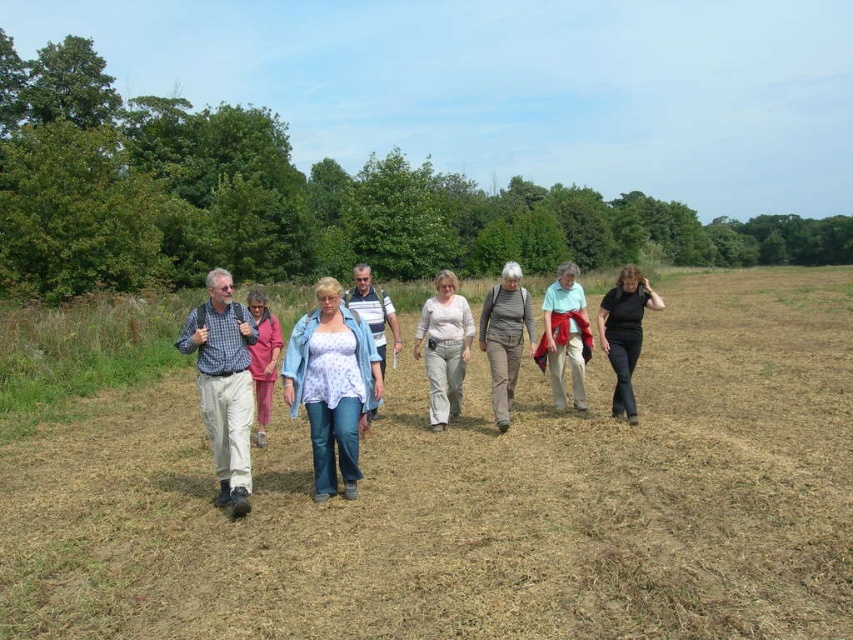
Question: In this image, where is blue denim jeans at center located relative to light beige pants at center?

Choices:
 (A) right
 (B) left

Answer: (B)

Question: Which is farther from the black matte pants at lower right?

Choices:
 (A) light blue denim jeans at center
 (B) gray cotton pants at center
 (C) checkered fabric shirt at left
 (D) blue denim jeans at center

Answer: (C)

Question: Among these points, which one is farthest from the camera?

Choices:
 (A) (386, 320)
 (B) (184, 333)
 (C) (489, 320)

Answer: (A)

Question: Which of these objects is positioned farthest from the light blue denim jeans at center?

Choices:
 (A) light beige pants at center
 (B) black matte pants at lower right
 (C) light blue cotton shirt at center
 (D) brown grassy field at center

Answer: (D)

Question: Can you confirm if brown grassy field at center is positioned above blue denim jeans at center?

Choices:
 (A) no
 (B) yes

Answer: (B)

Question: Is light blue cotton shirt at center to the right of light blue denim jeans at center from the viewer's perspective?

Choices:
 (A) no
 (B) yes

Answer: (B)